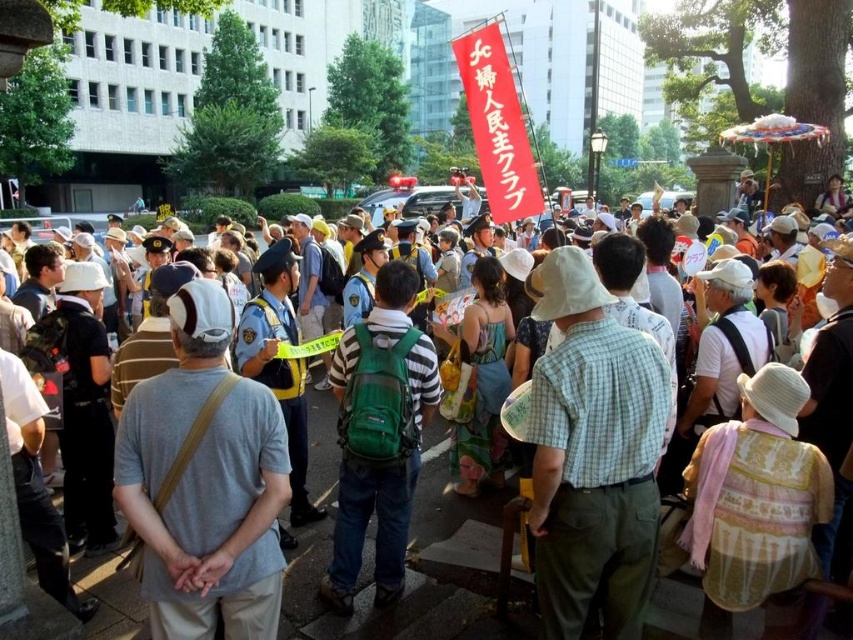
Question: In this image, where is woven fabric hat at center located relative to blue floral dress at center?

Choices:
 (A) right
 (B) left

Answer: (A)

Question: Which of the following is the farthest from the observer?

Choices:
 (A) click(x=837, y=204)
 (B) click(x=711, y=634)

Answer: (A)

Question: Among these objects, which one is farthest from the camera?

Choices:
 (A) pink woven hat at center
 (B) blue floral dress at center
 (C) gray fabric shirt at center

Answer: (A)

Question: Is gray fabric shirt at center above blue floral dress at center?

Choices:
 (A) no
 (B) yes

Answer: (A)

Question: Does gray fabric shirt at center appear over pink woven hat at center?

Choices:
 (A) no
 (B) yes

Answer: (A)

Question: Which of the following is the closest to the observer?

Choices:
 (A) pink woven hat at center
 (B) woven fabric hat at center
 (C) green backpack at center
 (D) gray fabric shirt at center

Answer: (C)